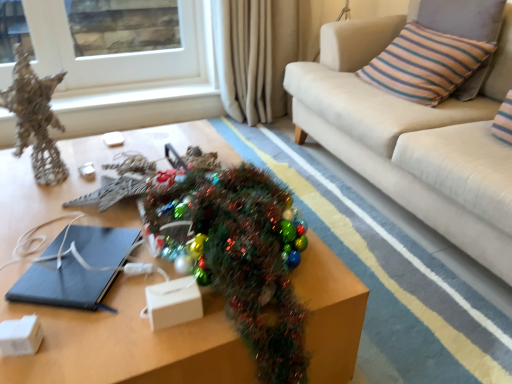
Question: Can you confirm if white glass window at upper left is shorter than beige fabric curtain at upper center?

Choices:
 (A) no
 (B) yes

Answer: (B)

Question: Is white glass window at upper left wider than beige fabric curtain at upper center?

Choices:
 (A) yes
 (B) no

Answer: (B)

Question: From a real-world perspective, is white glass window at upper left below beige fabric curtain at upper center?

Choices:
 (A) no
 (B) yes

Answer: (A)

Question: Considering the relative positions of white glass window at upper left and beige fabric curtain at upper center in the image provided, is white glass window at upper left to the left of beige fabric curtain at upper center from the viewer's perspective?

Choices:
 (A) no
 (B) yes

Answer: (B)

Question: Is white glass window at upper left located outside beige fabric curtain at upper center?

Choices:
 (A) no
 (B) yes

Answer: (B)

Question: Considering the relative positions of white glass window at upper left and beige fabric curtain at upper center in the image provided, is white glass window at upper left to the right of beige fabric curtain at upper center from the viewer's perspective?

Choices:
 (A) yes
 (B) no

Answer: (B)

Question: Does shiny metallic christmas tree at center come behind striped fabric pillow at upper right?

Choices:
 (A) yes
 (B) no

Answer: (B)

Question: From a real-world perspective, does shiny metallic christmas tree at center sit lower than striped fabric pillow at upper right?

Choices:
 (A) yes
 (B) no

Answer: (A)

Question: Is shiny metallic christmas tree at center outside of striped fabric pillow at upper right?

Choices:
 (A) yes
 (B) no

Answer: (A)

Question: From the image's perspective, would you say shiny metallic christmas tree at center is shown under striped fabric pillow at upper right?

Choices:
 (A) yes
 (B) no

Answer: (A)

Question: Is shiny metallic christmas tree at center thinner than striped fabric pillow at upper right?

Choices:
 (A) no
 (B) yes

Answer: (A)

Question: Considering the relative sizes of shiny metallic christmas tree at center and striped fabric pillow at upper right in the image provided, is shiny metallic christmas tree at center smaller than striped fabric pillow at upper right?

Choices:
 (A) yes
 (B) no

Answer: (B)

Question: Is matte black notebook at center taller than white glass window at upper left?

Choices:
 (A) no
 (B) yes

Answer: (A)